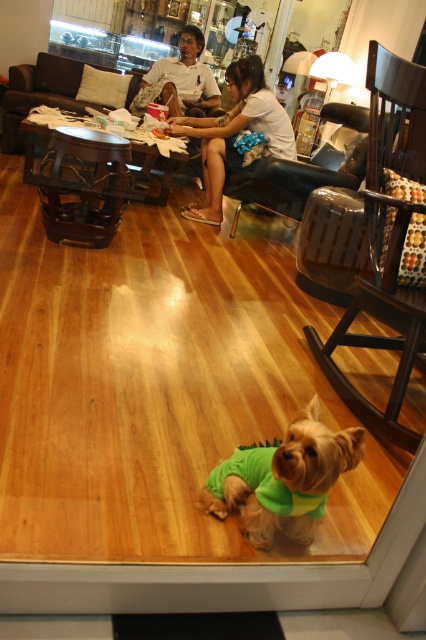
Consider the image. You are a photographer trying to capture a candid shot of the two people sitting on the dark leather couch. You notice there are two white shirts in the scene. How far apart are the white cotton shirt at upper center and the matte white shirt at upper center?

The white cotton shirt at upper center and the matte white shirt at upper center are 37.67 inches apart.

You are a photographer setting up a tripod in the living room. You need to ensure that the green fabric dog at center and the matte white shirt at upper center are both visible in the frame. Based on their heights, which object should be placed closer to the camera to ensure both are fully visible?

The green fabric dog at center is shorter than the matte white shirt at upper center. To ensure both are fully visible, the green fabric dog at center should be placed closer to the camera so its shorter height can be captured without being obscured by the taller matte white shirt at upper center.

You are a delivery robot with a 3 meter arm reach. You need to place a package on the floor near the green fabric dog at center. The white cotton shirt at upper center is in the way. Can your arm reach around them to place the package?

The green fabric dog at center is 2.95 meters away from the white cotton shirt at upper center. Since your arm can reach 3 meters, you can extend your arm past the white cotton shirt at upper center to place the package near the green fabric dog at center.